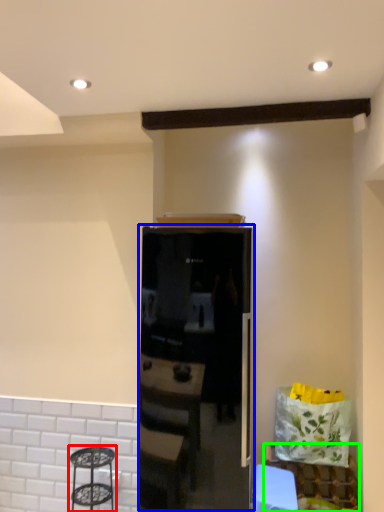
Question: Estimate the real-world distances between objects in this image. Which object is farther from step stool (highlighted by a red box), appliance (highlighted by a blue box) or furniture (highlighted by a green box)?

Choices:
 (A) appliance
 (B) furniture

Answer: (B)